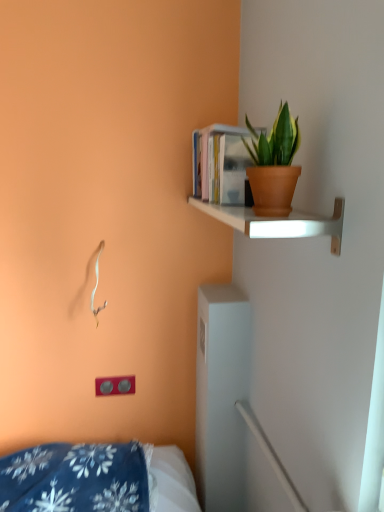
The height and width of the screenshot is (512, 384). Find the location of `hardcover books at upper right`. hardcover books at upper right is located at coordinates (221, 165).

Describe the element at coordinates (115, 385) in the screenshot. I see `matte gray electric outlet at lower left` at that location.

The image size is (384, 512). Describe the element at coordinates (278, 222) in the screenshot. I see `matte white shelf at upper right` at that location.

You are a GUI agent. You are given a task and a screenshot of the screen. Output one action in this format:
    pyautogui.click(x=<x>, y=<y>)
    Task: Click on the terracotta pot at upper right
    The height and width of the screenshot is (512, 384).
    Given the screenshot: What is the action you would take?
    pyautogui.click(x=274, y=165)

Relative to matte gray electric outlet at lower left, is matte white shelf at upper right in front or behind?

matte white shelf at upper right is positioned closer to the viewer than matte gray electric outlet at lower left.

From the picture: Measure the distance from matte white shelf at upper right to matte gray electric outlet at lower left.

matte white shelf at upper right is 38.28 inches away from matte gray electric outlet at lower left.

Is matte white shelf at upper right not close to matte gray electric outlet at lower left?

No, matte white shelf at upper right is not far away from matte gray electric outlet at lower left.

Does matte white shelf at upper right have a lesser width compared to matte gray electric outlet at lower left?

Incorrect, the width of matte white shelf at upper right is not less than that of matte gray electric outlet at lower left.

Does matte gray electric outlet at lower left have a lesser width compared to hardcover books at upper right?

Yes.

Between matte gray electric outlet at lower left and hardcover books at upper right, which one is positioned in front?

hardcover books at upper right is closer to the camera.

Is hardcover books at upper right located within matte gray electric outlet at lower left?

No.

Which of these two, matte gray electric outlet at lower left or hardcover books at upper right, is bigger?

Bigger between the two is hardcover books at upper right.

Considering the sizes of objects terracotta pot at upper right and matte gray electric outlet at lower left in the image provided, who is bigger, terracotta pot at upper right or matte gray electric outlet at lower left?

terracotta pot at upper right is bigger.

Could you tell me if terracotta pot at upper right is turned towards matte gray electric outlet at lower left?

No, terracotta pot at upper right is not turned towards matte gray electric outlet at lower left.

Can you confirm if matte white shelf at upper right is taller than hardcover books at upper right?

No, matte white shelf at upper right is not taller than hardcover books at upper right.

From a real-world perspective, is matte white shelf at upper right positioned over hardcover books at upper right based on gravity?

No, from a real-world perspective, matte white shelf at upper right is not over hardcover books at upper right

Is matte white shelf at upper right positioned with its back to hardcover books at upper right?

No.

Between matte white shelf at upper right and hardcover books at upper right, which one is positioned in front?

matte white shelf at upper right is closer to the camera.

Which object is positioned more to the right, terracotta pot at upper right or hardcover books at upper right?

Positioned to the right is terracotta pot at upper right.

Is terracotta pot at upper right facing away from hardcover books at upper right?

terracotta pot at upper right does not have its back to hardcover books at upper right.

Is terracotta pot at upper right far from hardcover books at upper right?

No, terracotta pot at upper right is not far away from hardcover books at upper right.

Considering the relative positions of terracotta pot at upper right and hardcover books at upper right in the image provided, is terracotta pot at upper right in front of hardcover books at upper right?

Yes, terracotta pot at upper right is in front of hardcover books at upper right.

Is matte white shelf at upper right positioned with its back to terracotta pot at upper right?

No, matte white shelf at upper right is not facing away from terracotta pot at upper right.

Considering the relative sizes of matte white shelf at upper right and terracotta pot at upper right in the image provided, is matte white shelf at upper right taller than terracotta pot at upper right?

No.

Does matte white shelf at upper right come in front of terracotta pot at upper right?

Yes, it is in front of terracotta pot at upper right.

How much distance is there between matte gray electric outlet at lower left and matte white shelf at upper right?

matte gray electric outlet at lower left is 38.28 inches from matte white shelf at upper right.

From a real-world perspective, is matte gray electric outlet at lower left positioned above or below matte white shelf at upper right?

In terms of real-world spatial position, matte gray electric outlet at lower left is below matte white shelf at upper right.

From the image's perspective, is matte gray electric outlet at lower left on top of matte white shelf at upper right?

No, from the image's perspective, matte gray electric outlet at lower left is not on top of matte white shelf at upper right.

Identify the location of shelf in front of the matte gray electric outlet at lower left. The height and width of the screenshot is (512, 384). (278, 222).

Where is `electric outlet on the left of hardcover books at upper right`? electric outlet on the left of hardcover books at upper right is located at coordinates (115, 385).

Looking at the image, which one is located further to terracotta pot at upper right, matte white shelf at upper right or matte gray electric outlet at lower left?

Among the two, matte gray electric outlet at lower left is located further to terracotta pot at upper right.

Considering their positions, is hardcover books at upper right positioned closer to matte gray electric outlet at lower left than matte white shelf at upper right?

hardcover books at upper right.

Estimate the real-world distances between objects in this image. Which object is further from matte white shelf at upper right, terracotta pot at upper right or matte gray electric outlet at lower left?

matte gray electric outlet at lower left lies further to matte white shelf at upper right than the other object.

Looking at the image, which one is located further to terracotta pot at upper right, hardcover books at upper right or matte white shelf at upper right?

hardcover books at upper right is positioned further to the anchor terracotta pot at upper right.

In the scene shown: Considering their positions, is matte gray electric outlet at lower left positioned further to hardcover books at upper right than terracotta pot at upper right?

matte gray electric outlet at lower left lies further to hardcover books at upper right than the other object.

From the image, which object appears to be farther from matte gray electric outlet at lower left, terracotta pot at upper right or hardcover books at upper right?

terracotta pot at upper right lies further to matte gray electric outlet at lower left than the other object.

Looking at the image, which one is located closer to matte white shelf at upper right, terracotta pot at upper right or hardcover books at upper right?

terracotta pot at upper right lies closer to matte white shelf at upper right than the other object.

Based on their spatial positions, is matte white shelf at upper right or hardcover books at upper right further from terracotta pot at upper right?

The object further to terracotta pot at upper right is hardcover books at upper right.

Where is `book between matte white shelf at upper right and matte gray electric outlet at lower left from front to back`? Image resolution: width=384 pixels, height=512 pixels. book between matte white shelf at upper right and matte gray electric outlet at lower left from front to back is located at coordinates (221, 165).

This screenshot has height=512, width=384. I want to click on houseplant between hardcover books at upper right and matte gray electric outlet at lower left vertically, so click(x=274, y=165).

Where is `houseplant between matte white shelf at upper right and matte gray electric outlet at lower left from front to back`? Image resolution: width=384 pixels, height=512 pixels. houseplant between matte white shelf at upper right and matte gray electric outlet at lower left from front to back is located at coordinates pyautogui.click(x=274, y=165).

Locate an element on the screen. This screenshot has width=384, height=512. houseplant located between matte white shelf at upper right and hardcover books at upper right in the depth direction is located at coordinates coord(274,165).